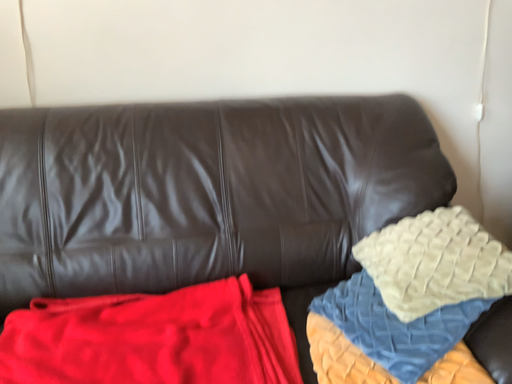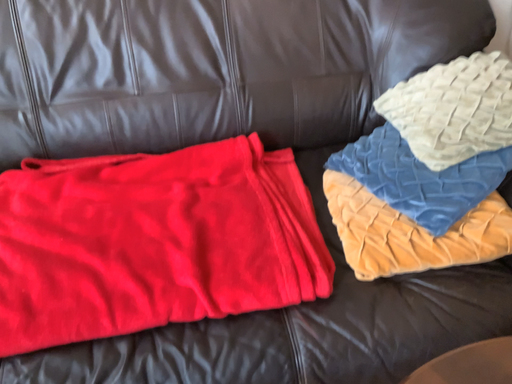
Question: How did the camera likely rotate when shooting the video?

Choices:
 (A) rotated upward
 (B) rotated downward

Answer: (B)